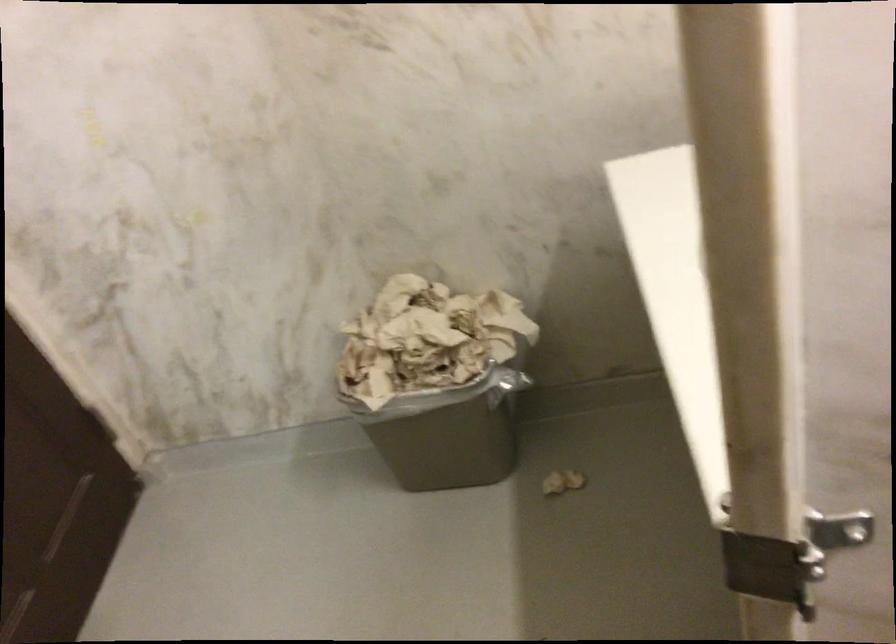
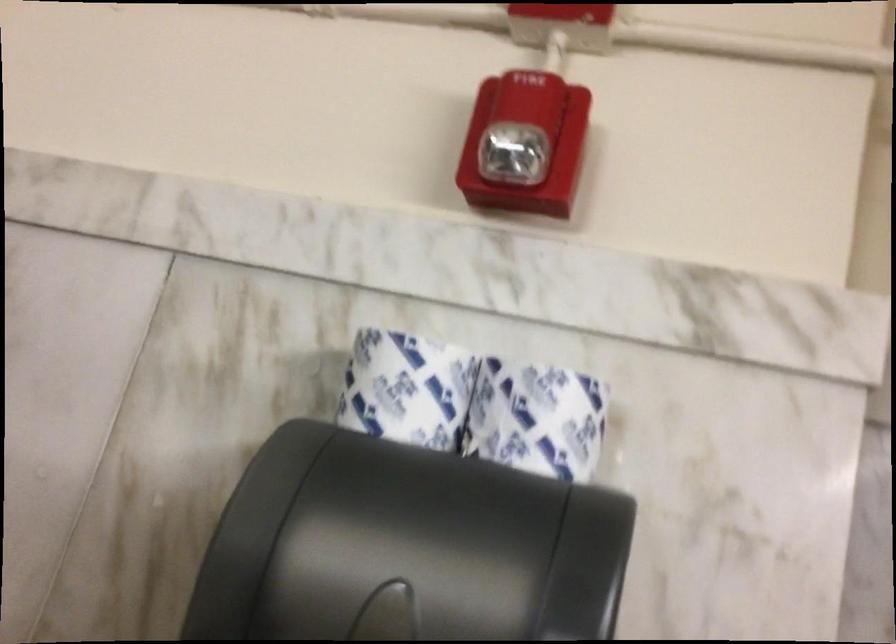
From the picture: The first image is from the beginning of the video and the second image is from the end. How did the camera likely rotate when shooting the video?

The rotation direction of the camera is left-up.